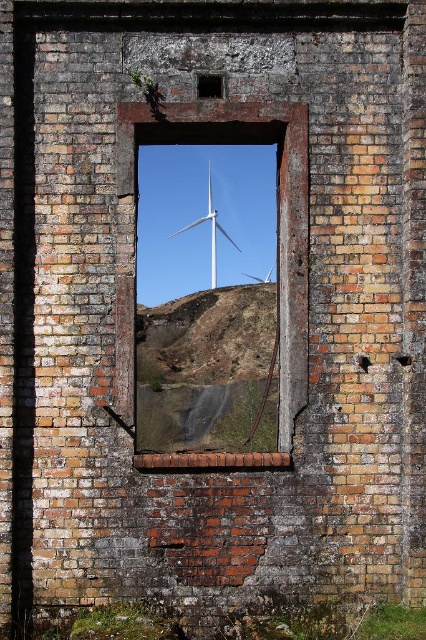
You are standing in front of a weathered brick wall with a broken window frame. There is a point marked at coordinates (278, 236). What object is located at that specific coordinate?

The point at coordinates (278, 236) is occupied by a brick at center.

You are a construction worker inspecting the brick wall with a window. You notice the brick at center and the white matte wind turbine at center. Which object is located below the other?

The brick at center is positioned under the white matte wind turbine at center, meaning the brick is below the wind turbine.

You are a drone operator trying to capture a photo of the brick at center and the white matte wind turbine at center from a safe altitude. What is the minimum distance you need to maintain between the two objects to ensure both are in frame?

The minimum distance required between the brick at center and the white matte wind turbine at center should be at least 24.88 meters to ensure both are captured in the frame.